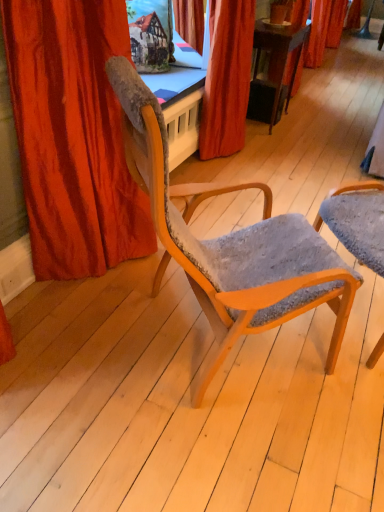
Question: Which direction should I rotate to look at velvet red curtain at center, which is the 1th curtain from right to left, — up or down?

Choices:
 (A) up
 (B) down

Answer: (A)

Question: Which direction should I rotate to look at textured gray fabric chair at center, positioned as the second chair in left-to-right order, — up or down?

Choices:
 (A) up
 (B) down

Answer: (B)

Question: Does velvet orange curtain at left, the first curtain when ordered from front to back, touch textured gray fabric chair at center, positioned as the second chair in left-to-right order?

Choices:
 (A) no
 (B) yes

Answer: (A)

Question: Can you confirm if velvet orange curtain at left, acting as the 2th curtain starting from the right, is wider than textured gray fabric chair at center, positioned as the second chair in left-to-right order?

Choices:
 (A) no
 (B) yes

Answer: (A)

Question: Can you confirm if velvet orange curtain at left, acting as the 2th curtain starting from the right, is bigger than textured gray fabric chair at center, marked as the first chair in a right-to-left arrangement?

Choices:
 (A) yes
 (B) no

Answer: (A)

Question: Is velvet orange curtain at left, the second curtain when ordered from back to front, smaller than textured gray fabric chair at center, marked as the first chair in a right-to-left arrangement?

Choices:
 (A) yes
 (B) no

Answer: (B)

Question: From a real-world perspective, is velvet orange curtain at left, which is the 1th curtain from left to right, positioned under textured gray fabric chair at center, positioned as the second chair in left-to-right order, based on gravity?

Choices:
 (A) no
 (B) yes

Answer: (A)

Question: Is velvet orange curtain at left, the second curtain when ordered from back to front, facing towards textured gray fabric chair at center, positioned as the second chair in left-to-right order?

Choices:
 (A) no
 (B) yes

Answer: (B)

Question: Are velvet orange curtain at left, the first curtain when ordered from front to back, and wooden chair with textured fabric at center, arranged as the 2th chair when viewed from the right, located far from each other?

Choices:
 (A) no
 (B) yes

Answer: (A)

Question: Does velvet orange curtain at left, the first curtain when ordered from front to back, have a lesser width compared to wooden chair with textured fabric at center, the 1th chair in the left-to-right sequence?

Choices:
 (A) yes
 (B) no

Answer: (A)

Question: Does velvet orange curtain at left, acting as the 2th curtain starting from the right, contain wooden chair with textured fabric at center, arranged as the 2th chair when viewed from the right?

Choices:
 (A) yes
 (B) no

Answer: (B)

Question: Is velvet orange curtain at left, the second curtain when ordered from back to front, further to the viewer compared to wooden chair with textured fabric at center, arranged as the 2th chair when viewed from the right?

Choices:
 (A) no
 (B) yes

Answer: (B)

Question: From the image's perspective, is velvet orange curtain at left, the first curtain when ordered from front to back, over wooden chair with textured fabric at center, arranged as the 2th chair when viewed from the right?

Choices:
 (A) no
 (B) yes

Answer: (B)

Question: Is velvet orange curtain at left, acting as the 2th curtain starting from the right, located outside wooden chair with textured fabric at center, arranged as the 2th chair when viewed from the right?

Choices:
 (A) yes
 (B) no

Answer: (A)

Question: Is velvet red curtain at center, marked as the 1th curtain in a back-to-front arrangement, located within textured gray fabric chair at center, positioned as the second chair in left-to-right order?

Choices:
 (A) no
 (B) yes

Answer: (A)